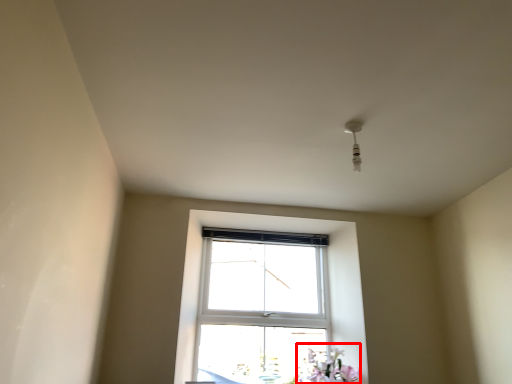
Question: From the image's perspective, considering the relative positions of flower (annotated by the red box) and light fixture in the image provided, where is flower (annotated by the red box) located with respect to the staircase?

Choices:
 (A) above
 (B) below

Answer: (B)